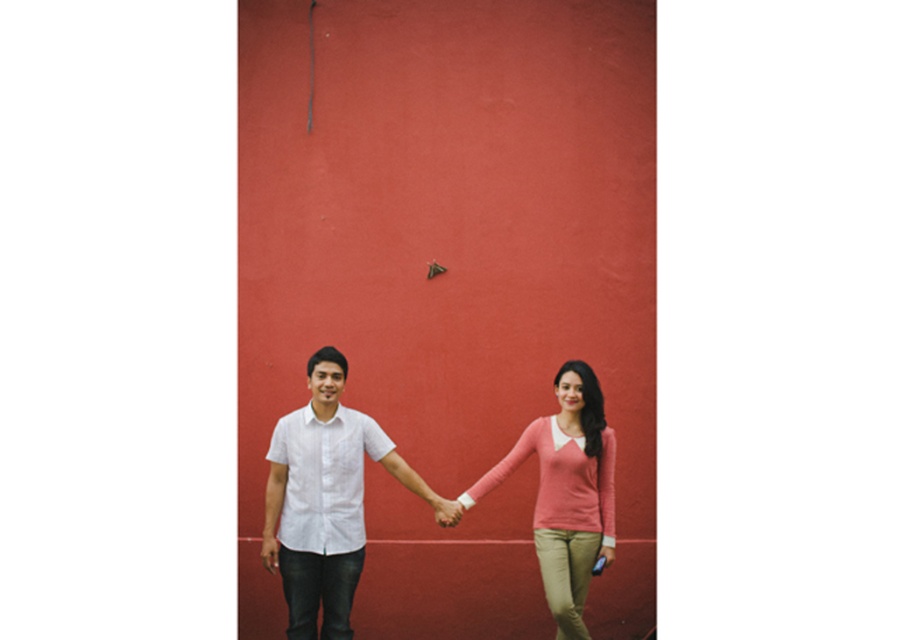
Question: Which of the following is the farthest from the observer?

Choices:
 (A) (570, 627)
 (B) (443, 513)
 (C) (318, 435)

Answer: (C)

Question: Which point is closer to the camera?

Choices:
 (A) (599, 426)
 (B) (340, 528)

Answer: (B)

Question: Does pink sweater at center lie behind matte pink hand at center?

Choices:
 (A) no
 (B) yes

Answer: (A)

Question: Observing the image, what is the correct spatial positioning of white cotton shirt at center in reference to matte pink hand at center?

Choices:
 (A) left
 (B) right

Answer: (A)

Question: Can you confirm if white cotton shirt at center is positioned above pink sweater at center?

Choices:
 (A) no
 (B) yes

Answer: (A)

Question: Which is farther from the matte pink hand at center?

Choices:
 (A) white cotton shirt at center
 (B) pink sweater at center

Answer: (A)